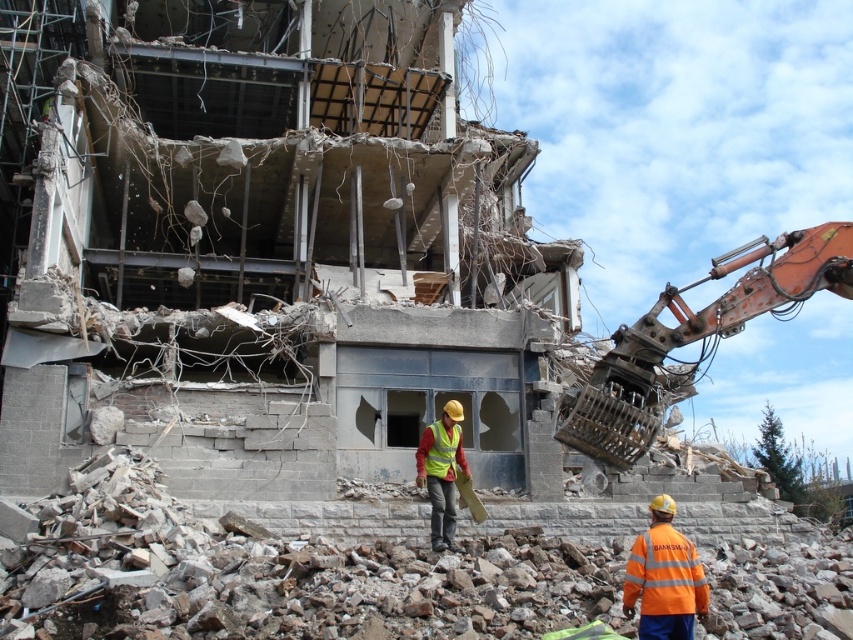
Is reflective yellow vest at center to the left of high visibility fabric safety vest at center from the viewer's perspective?

Yes, reflective yellow vest at center is to the left of high visibility fabric safety vest at center.

Who is lower down, reflective yellow vest at center or high visibility fabric safety vest at center?

reflective yellow vest at center is lower down.

Where is `reflective yellow vest at center`? The width and height of the screenshot is (853, 640). reflective yellow vest at center is located at coordinates (440, 472).

Identify the location of reflective yellow vest at center. This screenshot has width=853, height=640. (440, 472).

Does rusty metal excavator at right have a lesser width compared to high visibility fabric safety vest at center?

No.

Can you confirm if rusty metal excavator at right is positioned above high visibility fabric safety vest at center?

Yes, rusty metal excavator at right is above high visibility fabric safety vest at center.

Does point (717, 333) come farther from viewer compared to point (426, 461)?

No, it is in front of (426, 461).

The image size is (853, 640). I want to click on rusty metal excavator at right, so click(695, 337).

Who is more forward, (653, 508) or (419, 442)?

Point (653, 508) is more forward.

Is orange reflective vest at lower right bigger than reflective yellow vest at center?

Correct, orange reflective vest at lower right is larger in size than reflective yellow vest at center.

Is point (682, 627) positioned before point (453, 461)?

Yes, it is in front of point (453, 461).

Locate an element on the screen. orange reflective vest at lower right is located at coordinates (664, 577).